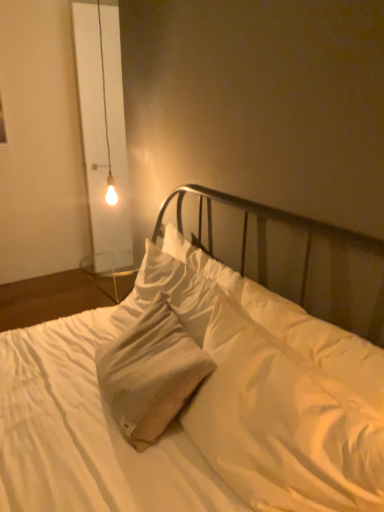
Question: From a real-world perspective, is white cotton pillow at center positioned under matte glass bulb at upper left based on gravity?

Choices:
 (A) no
 (B) yes

Answer: (B)

Question: Considering the relative sizes of white cotton pillow at center and matte glass bulb at upper left in the image provided, is white cotton pillow at center wider than matte glass bulb at upper left?

Choices:
 (A) no
 (B) yes

Answer: (B)

Question: Is white cotton pillow at center placed right next to matte glass bulb at upper left?

Choices:
 (A) no
 (B) yes

Answer: (A)

Question: Is white cotton pillow at center to the right of matte glass bulb at upper left from the viewer's perspective?

Choices:
 (A) yes
 (B) no

Answer: (A)

Question: Can you confirm if white cotton pillow at center is positioned to the left of matte glass bulb at upper left?

Choices:
 (A) no
 (B) yes

Answer: (A)

Question: From the image's perspective, relative to white cotton pillow at center, is white cotton bed at center above or below?

Choices:
 (A) below
 (B) above

Answer: (B)

Question: In terms of height, does white cotton bed at center look taller or shorter compared to white cotton pillow at center?

Choices:
 (A) short
 (B) tall

Answer: (B)

Question: Considering their positions, is white cotton bed at center located in front of or behind white cotton pillow at center?

Choices:
 (A) front
 (B) behind

Answer: (A)

Question: Looking at the image, does white cotton bed at center seem bigger or smaller compared to white cotton pillow at center?

Choices:
 (A) small
 (B) big

Answer: (B)

Question: In terms of width, does white cotton bed at center look wider or thinner when compared to matte glass bulb at upper left?

Choices:
 (A) wide
 (B) thin

Answer: (A)

Question: Considering the relative positions of white cotton bed at center and matte glass bulb at upper left in the image provided, is white cotton bed at center to the left or to the right of matte glass bulb at upper left?

Choices:
 (A) left
 (B) right

Answer: (B)

Question: From a real-world perspective, is white cotton bed at center positioned above or below matte glass bulb at upper left?

Choices:
 (A) below
 (B) above

Answer: (A)

Question: Is point (198, 263) closer or farther from the camera than point (97, 23)?

Choices:
 (A) farther
 (B) closer

Answer: (B)

Question: From a real-world perspective, relative to matte glass bulb at upper left, is white cotton pillow at center vertically above or below?

Choices:
 (A) below
 (B) above

Answer: (A)

Question: Is white cotton pillow at center taller or shorter than matte glass bulb at upper left?

Choices:
 (A) tall
 (B) short

Answer: (B)